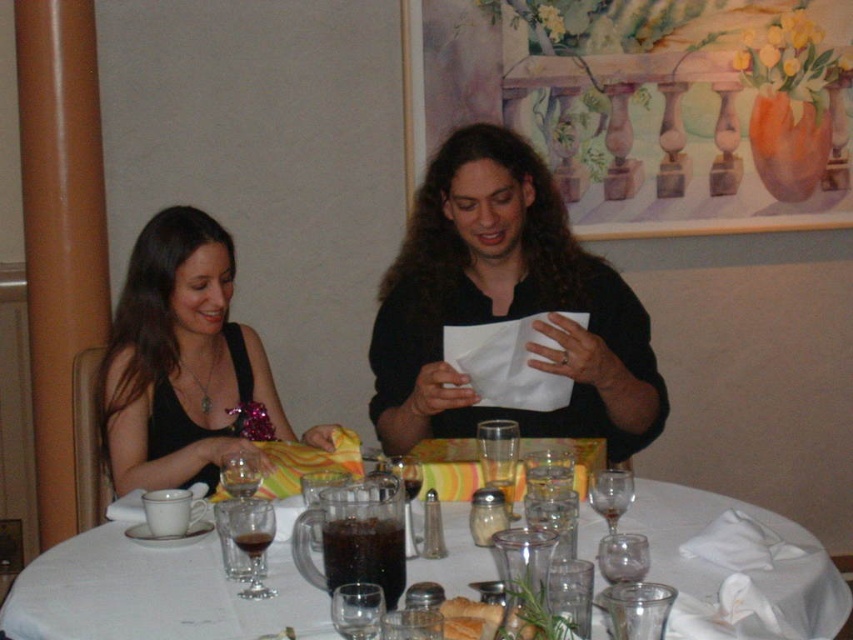
Question: Is translucent glass table at center positioned behind transparent glass wine glass at table center?

Choices:
 (A) yes
 (B) no

Answer: (B)

Question: Which point is closer to the camera?

Choices:
 (A) (607, 472)
 (B) (483, 604)
 (C) (268, 506)
 (D) (158, 353)

Answer: (B)

Question: Where is translucent glass table at center located in relation to transparent glass wine glass at center in the image?

Choices:
 (A) below
 (B) above

Answer: (A)

Question: Which point is closer to the camera?

Choices:
 (A) (218, 360)
 (B) (329, 604)
 (C) (238, 540)
 (D) (604, 493)

Answer: (B)

Question: Is black matte dress at left closer to the viewer compared to golden brown bread at center?

Choices:
 (A) yes
 (B) no

Answer: (B)

Question: Which point is farther to the camera?

Choices:
 (A) translucent glass table at center
 (B) golden brown bread at center
 (C) black matte dress at left
 (D) transparent glass at center

Answer: (C)